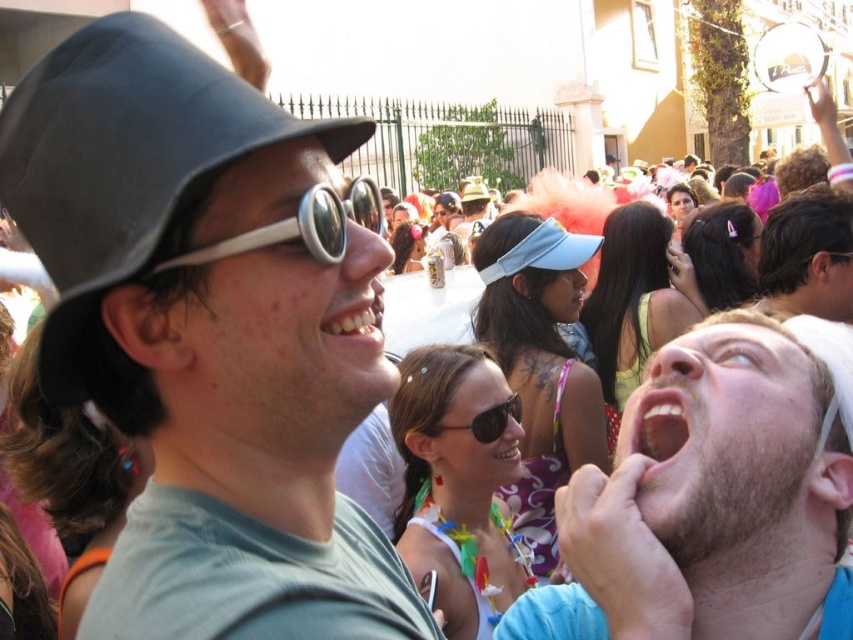
Question: Which of the following is the closest to the observer?

Choices:
 (A) (569, 516)
 (B) (236, 253)
 (C) (672, 429)

Answer: (B)

Question: Estimate the real-world distances between objects in this image. Which object is farther from the white glossy teeth at center?

Choices:
 (A) matte gray hat at upper left
 (B) smooth brown hair at center
 (C) sunglasses at center
 (D) pink matte lips at lower right

Answer: (B)

Question: Can you confirm if beige fabric headband at upper right is thinner than smooth brown hair at center?

Choices:
 (A) yes
 (B) no

Answer: (B)

Question: Is pink matte lips at lower right wider than white glossy teeth at center?

Choices:
 (A) yes
 (B) no

Answer: (A)

Question: Which point appears farthest from the camera in this image?

Choices:
 (A) (36, 227)
 (B) (363, 294)

Answer: (B)

Question: Is smooth brown hair at center wider than silver reflective goggles at upper center?

Choices:
 (A) yes
 (B) no

Answer: (B)